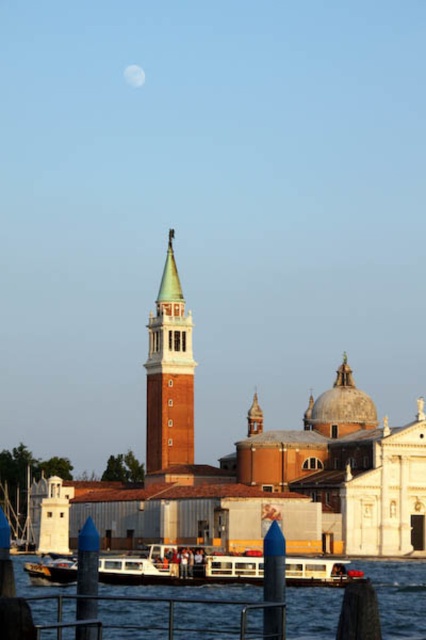
Question: Based on their relative distances, which object is farther from the wooden polished boat at lower left?

Choices:
 (A) brick steeple at center
 (B) smooth water at center

Answer: (A)

Question: Based on their relative distances, which object is nearer to the brick steeple at center?

Choices:
 (A) wooden polished boat at lower left
 (B) smooth water at center

Answer: (A)

Question: Can you confirm if brick steeple at center is positioned to the left of white matte boat at center?

Choices:
 (A) yes
 (B) no

Answer: (A)

Question: Is the position of smooth water at center more distant than that of white matte boat at center?

Choices:
 (A) yes
 (B) no

Answer: (B)

Question: Based on their relative distances, which object is farther from the brick steeple at center?

Choices:
 (A) white matte boat at center
 (B) wooden polished boat at lower left

Answer: (A)

Question: Does brick steeple at center appear on the left side of wooden polished boat at lower left?

Choices:
 (A) yes
 (B) no

Answer: (B)